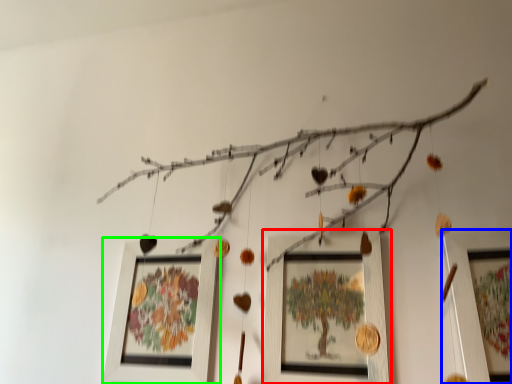
Question: Which object is the closest to the picture frame (highlighted by a red box)? Choose among these: picture frame (highlighted by a blue box) or picture frame (highlighted by a green box).

Choices:
 (A) picture frame
 (B) picture frame

Answer: (A)